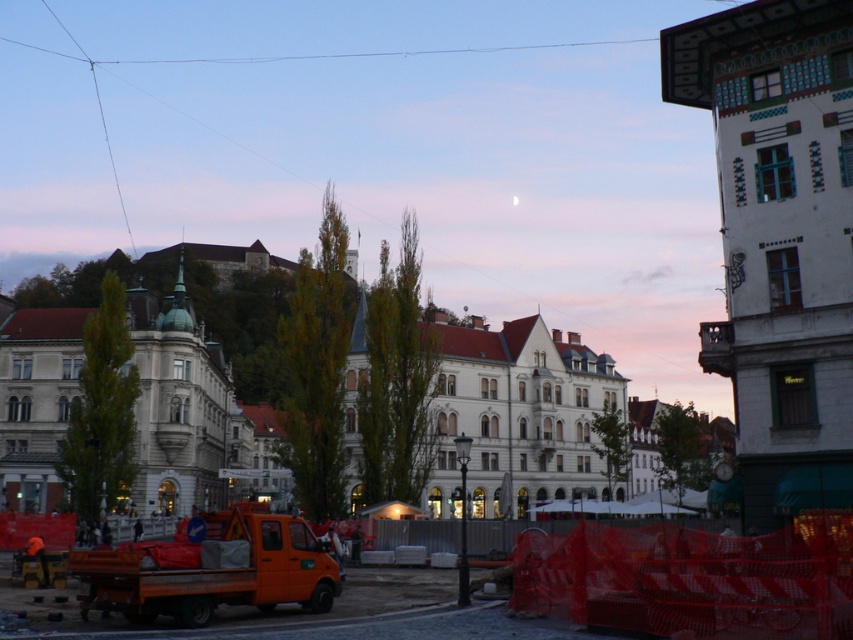
You are standing at the center of the cobblestone street in the image. There is an orange fabric at lower left. Where is the point located at coordinates point (689, 579)?

The point located at coordinates point (689, 579) is on the orange fabric at lower left.